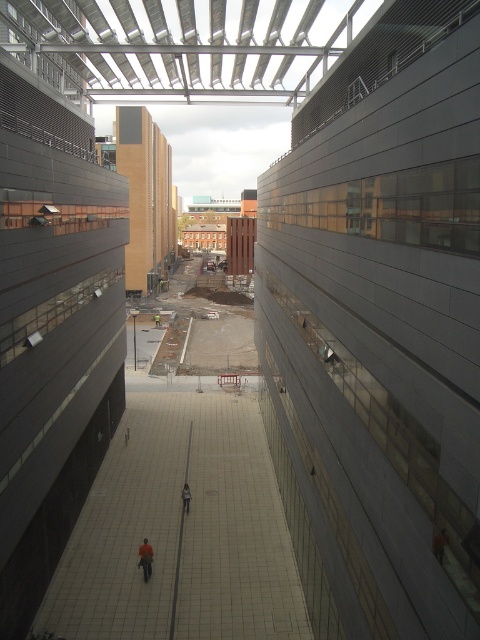
Can you confirm if white tile floor at center is positioned above orange fabric person at center?

Correct, white tile floor at center is located above orange fabric person at center.

Is point (207, 499) farther from camera compared to point (146, 552)?

Yes, it is.

This screenshot has height=640, width=480. Identify the location of white tile floor at center. (180, 531).

Is orange fabric person at center shorter than orange fabric person at lower right?

Incorrect, orange fabric person at center's height does not fall short of orange fabric person at lower right's.

Which is in front, point (143, 564) or point (439, 532)?

Point (439, 532)

Describe the element at coordinates (145, 557) in the screenshot. This screenshot has height=640, width=480. I see `orange fabric person at center` at that location.

Locate an element on the screen. The width and height of the screenshot is (480, 640). orange fabric person at center is located at coordinates (145, 557).

Is white tile floor at center wider than dark gray jacket at center?

Yes, white tile floor at center is wider than dark gray jacket at center.

Between white tile floor at center and dark gray jacket at center, which one has less height?

With less height is dark gray jacket at center.

Locate an element on the screen. white tile floor at center is located at coordinates (180, 531).